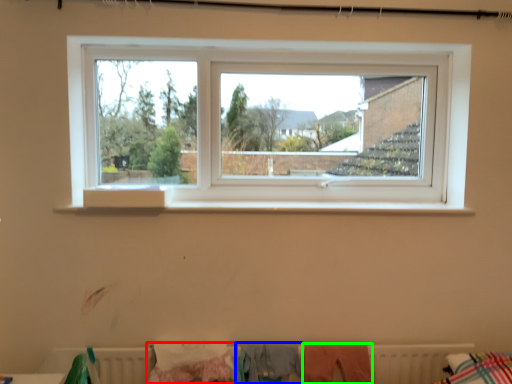
Question: Estimate the real-world distances between objects in this image. Which object is farther from clothing (highlighted by a red box), clothing (highlighted by a blue box) or clothing (highlighted by a green box)?

Choices:
 (A) clothing
 (B) clothing

Answer: (B)